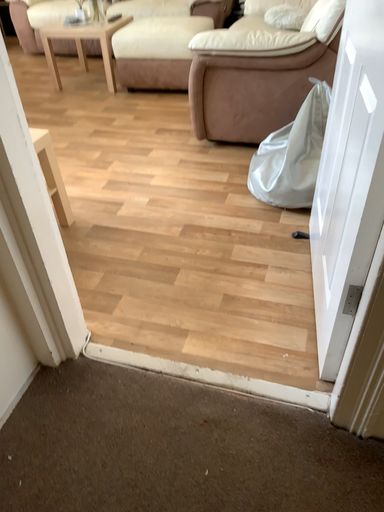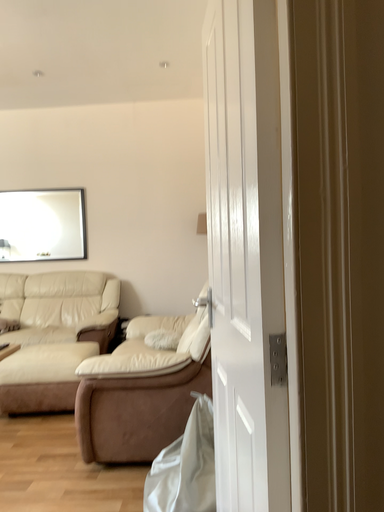
Question: How did the camera likely rotate when shooting the video?

Choices:
 (A) rotated upward
 (B) rotated downward

Answer: (A)